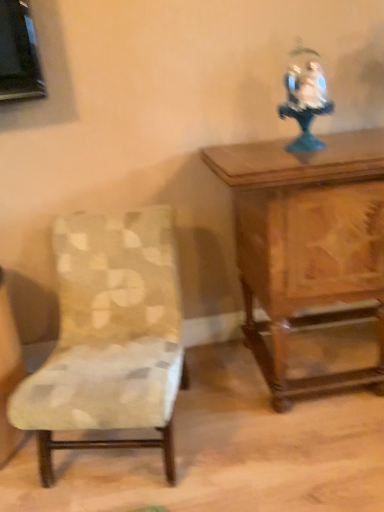
Question: Is patterned fabric chair at left wider than white porcelain figurine at upper right?

Choices:
 (A) yes
 (B) no

Answer: (A)

Question: Is patterned fabric chair at left positioned in front of white porcelain figurine at upper right?

Choices:
 (A) yes
 (B) no

Answer: (A)

Question: Considering the relative sizes of patterned fabric chair at left and white porcelain figurine at upper right in the image provided, is patterned fabric chair at left shorter than white porcelain figurine at upper right?

Choices:
 (A) no
 (B) yes

Answer: (A)

Question: Considering the relative positions of patterned fabric chair at left and white porcelain figurine at upper right in the image provided, is patterned fabric chair at left to the right of white porcelain figurine at upper right from the viewer's perspective?

Choices:
 (A) yes
 (B) no

Answer: (B)

Question: Considering the relative sizes of patterned fabric chair at left and white porcelain figurine at upper right in the image provided, is patterned fabric chair at left thinner than white porcelain figurine at upper right?

Choices:
 (A) yes
 (B) no

Answer: (B)

Question: Do you think patterned fabric chair at left is within white porcelain figurine at upper right, or outside of it?

Choices:
 (A) outside
 (B) inside

Answer: (A)

Question: From a real-world perspective, is patterned fabric chair at left positioned above or below white porcelain figurine at upper right?

Choices:
 (A) below
 (B) above

Answer: (A)

Question: Is patterned fabric chair at left in front of or behind white porcelain figurine at upper right in the image?

Choices:
 (A) front
 (B) behind

Answer: (A)

Question: Does point click(x=173, y=314) appear closer or farther from the camera than point click(x=292, y=140)?

Choices:
 (A) closer
 (B) farther

Answer: (A)

Question: Based on their positions, is wooden carved table at upper right located to the left or right of patterned fabric chair at left?

Choices:
 (A) left
 (B) right

Answer: (B)

Question: Considering the positions of wooden carved table at upper right and patterned fabric chair at left in the image, is wooden carved table at upper right wider or thinner than patterned fabric chair at left?

Choices:
 (A) thin
 (B) wide

Answer: (A)

Question: In terms of height, does wooden carved table at upper right look taller or shorter compared to patterned fabric chair at left?

Choices:
 (A) tall
 (B) short

Answer: (A)

Question: Is point (336, 192) closer or farther from the camera than point (38, 410)?

Choices:
 (A) farther
 (B) closer

Answer: (A)

Question: In the image, is patterned fabric chair at left on the left side or the right side of wooden carved table at upper right?

Choices:
 (A) right
 (B) left

Answer: (B)

Question: Is patterned fabric chair at left in front of or behind wooden carved table at upper right in the image?

Choices:
 (A) behind
 (B) front

Answer: (B)